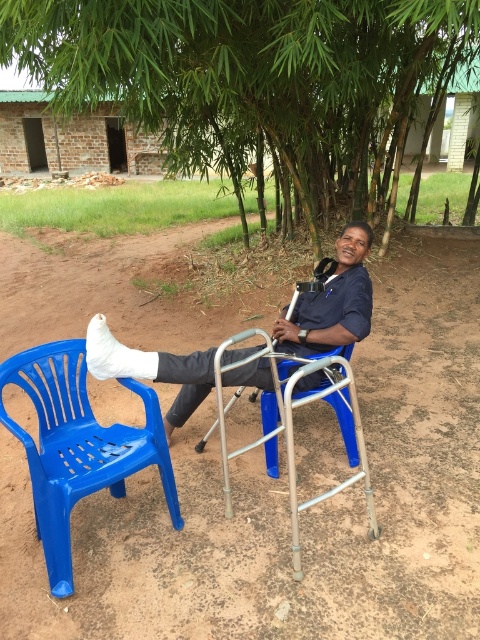
Question: Observing the image, what is the correct spatial positioning of green bamboo at center in reference to blue plastic chair at lower left?

Choices:
 (A) below
 (B) above

Answer: (B)

Question: Does blue plastic chair at lower left appear under white cast leg at center?

Choices:
 (A) no
 (B) yes

Answer: (B)

Question: Which is farther from the blue plastic chair at center?

Choices:
 (A) blue plastic chair at lower left
 (B) dirt field at center
 (C) white cast leg at center
 (D) green bamboo at center

Answer: (D)

Question: Is blue plastic chair at lower left smaller than blue plastic chair at center?

Choices:
 (A) no
 (B) yes

Answer: (B)

Question: Which of the following is the farthest from the observer?

Choices:
 (A) green bamboo at center
 (B) blue plastic chair at center

Answer: (A)

Question: Considering the real-world distances, which object is farthest from the blue plastic chair at center?

Choices:
 (A) blue plastic chair at lower left
 (B) white cast leg at center
 (C) green bamboo at center
 (D) dirt field at center

Answer: (C)